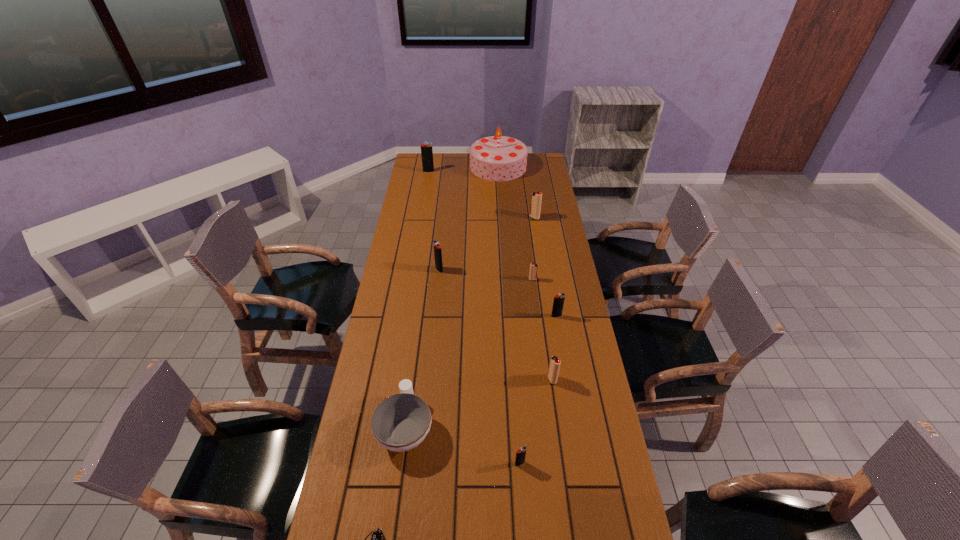
I want to click on the tallest object, so click(495, 158).

Identify the location of the biggest black igniter. Image resolution: width=960 pixels, height=540 pixels. point(426,149).

Image resolution: width=960 pixels, height=540 pixels. I want to click on the second tallest object, so click(426, 149).

Image resolution: width=960 pixels, height=540 pixels. Identify the location of the biggest red igniter. (536, 198).

Where is `the second farthest igniter`? The width and height of the screenshot is (960, 540). the second farthest igniter is located at coordinates (536, 198).

Identify the location of the second igniter from left to right. (437, 248).

You are a GUI agent. You are given a task and a screenshot of the screen. Output one action in this format:
    pyautogui.click(x=<x>, y=<y>)
    Task: Click on the second black igniter from left to right
    The width and height of the screenshot is (960, 540).
    Given the screenshot: What is the action you would take?
    pyautogui.click(x=437, y=248)

Where is `the fifth nearest object`? the fifth nearest object is located at coordinates (558, 302).

At what (x,y) coordinates should I click in order to perform the action: click on the rightmost black igniter. Please return your answer as a coordinate pair (x, y). Looking at the image, I should click on (558, 302).

Where is `the nearest red igniter`? the nearest red igniter is located at coordinates (555, 362).